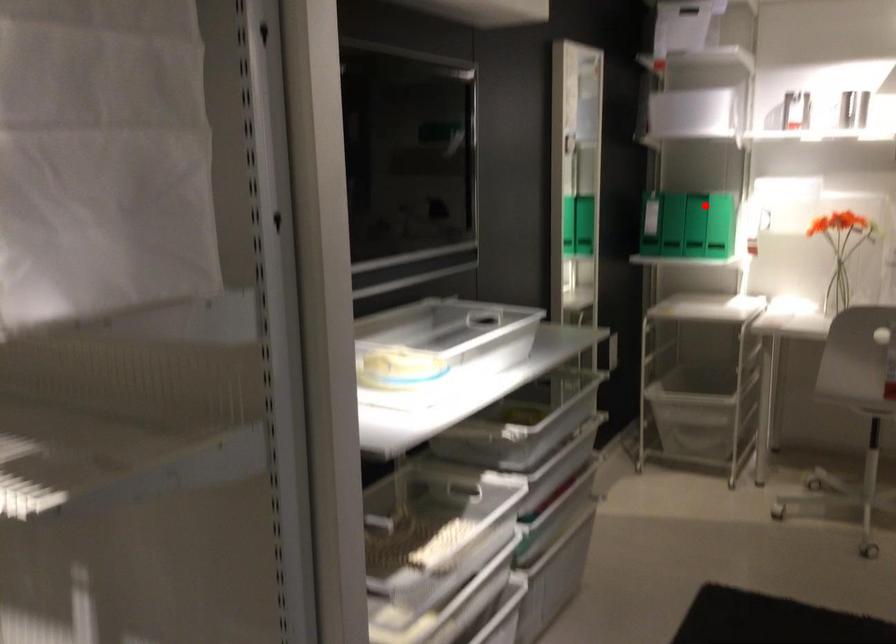
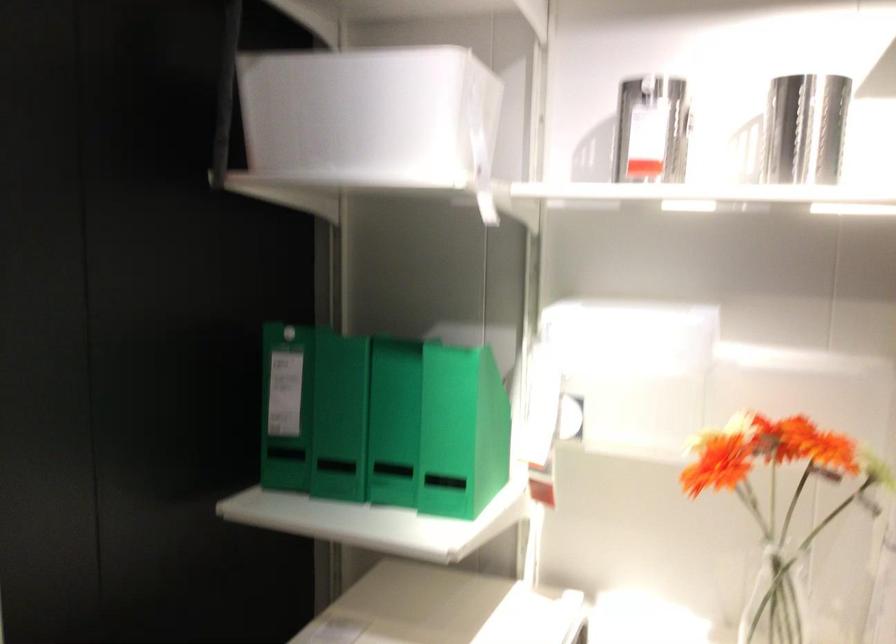
Question: I am providing you with two images of the same scene from different viewpoints. Given a red point in image1, look at the same physical point in image2. Is it:

Choices:
 (A) Closer to the viewpoint
 (B) Farther from the viewpoint

Answer: (A)